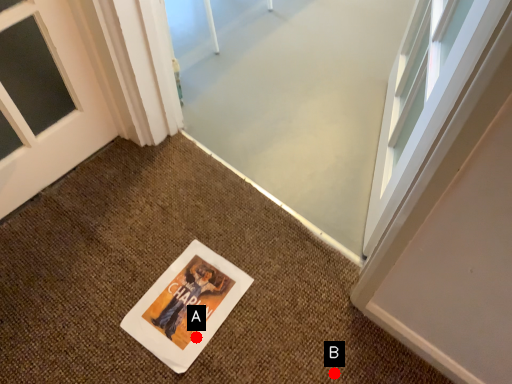
Question: Two points are circled on the image, labeled by A and B beside each circle. Which of the following is the farthest from the observer?

Choices:
 (A) A is further
 (B) B is further

Answer: (A)